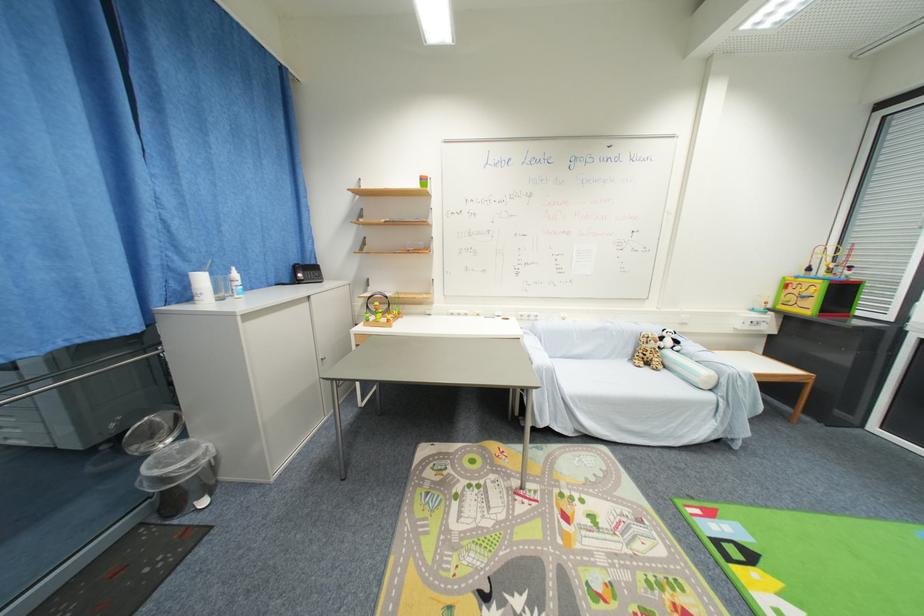
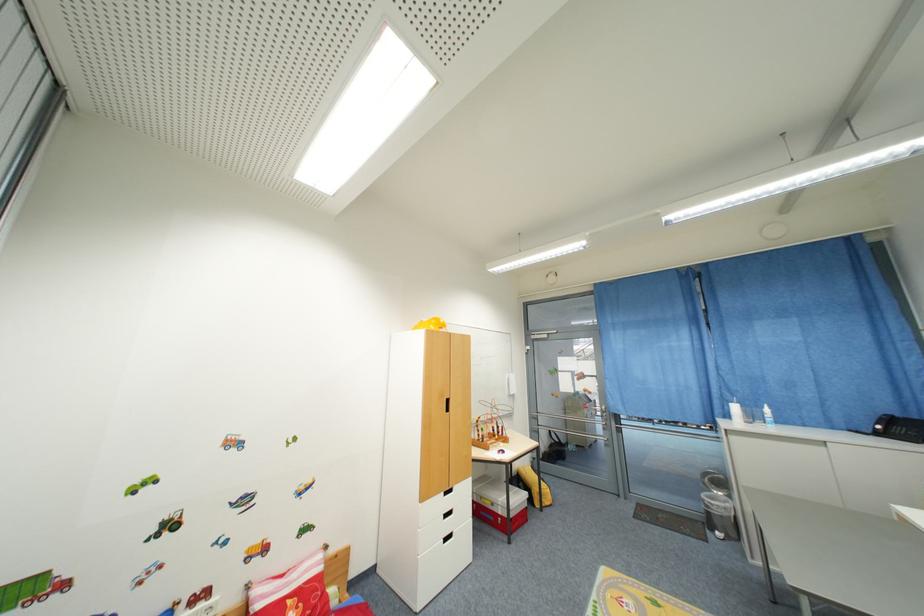
Question: I am providing you with two images of the same scene from different viewpoints. Please identify which objects are invisible in image2.

Choices:
 (A) clear sanitizer bottle
 (B) telephone handset
 (C) white drawer handle
 (D) none of these

Answer: (D)